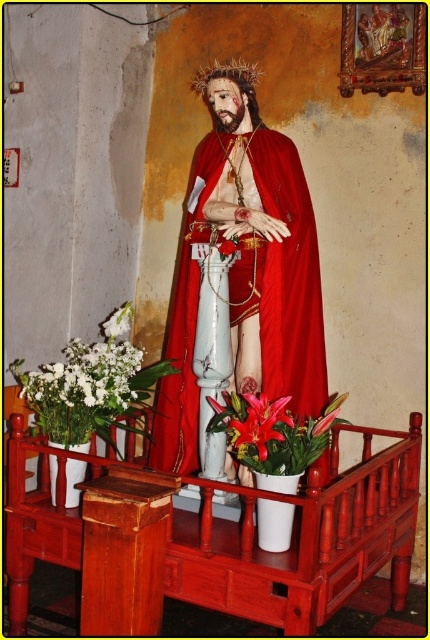
You are an interior designer planning to place a new decorative item on the altar in front of the religious statue. The current setup has matte pink lilies at center. Where exactly should you position the new item to avoid overlapping with the existing lilies?

The matte pink lilies at center are located at point (273, 432), so you should position the new item away from that coordinate to avoid overlapping.

You are a visitor to the church and want to place a small candle on the altar in front of the statue. The candle is 10 cm tall. The white matte flowers at lower left and the pink matte lily at center are already on the altar. Which object is taller than the candle?

The white matte flowers at lower left is taller than the pink matte lily at center. Since the candle is 10 cm tall, we can infer that the white matte flowers at lower left is taller than the candle.